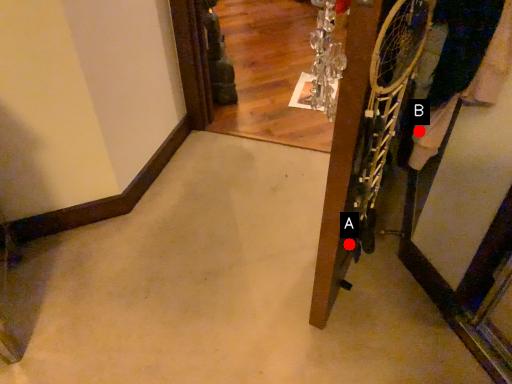
Question: Two points are circled on the image, labeled by A and B beside each circle. Which point is closer to the camera taking this photo?

Choices:
 (A) A is closer
 (B) B is closer

Answer: (B)